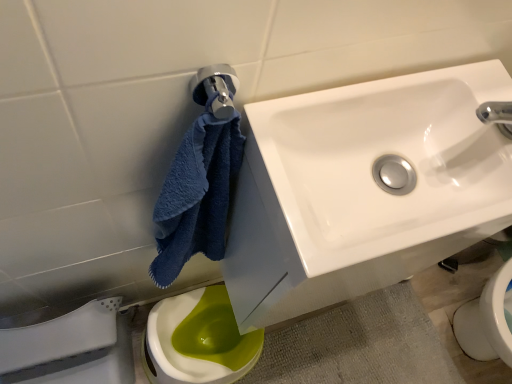
Question: Is white glossy porcelain at lower left at the right side of white glossy sink at upper right?

Choices:
 (A) no
 (B) yes

Answer: (A)

Question: Is white glossy porcelain at lower left shorter than white glossy sink at upper right?

Choices:
 (A) no
 (B) yes

Answer: (A)

Question: Considering the relative sizes of white glossy porcelain at lower left and white glossy sink at upper right in the image provided, is white glossy porcelain at lower left smaller than white glossy sink at upper right?

Choices:
 (A) no
 (B) yes

Answer: (A)

Question: Is white glossy porcelain at lower left facing away from white glossy sink at upper right?

Choices:
 (A) no
 (B) yes

Answer: (A)

Question: Is white glossy porcelain at lower left at the left side of white glossy sink at upper right?

Choices:
 (A) no
 (B) yes

Answer: (B)

Question: From the image's perspective, is white glossy porcelain at lower left below white glossy sink at upper right?

Choices:
 (A) yes
 (B) no

Answer: (A)

Question: From the image's perspective, is white glossy sink at upper right located beneath green glossy toilet at lower left?

Choices:
 (A) no
 (B) yes

Answer: (A)

Question: Can you confirm if white glossy sink at upper right is positioned to the left of green glossy toilet at lower left?

Choices:
 (A) no
 (B) yes

Answer: (A)

Question: Can you confirm if white glossy sink at upper right is positioned to the right of green glossy toilet at lower left?

Choices:
 (A) no
 (B) yes

Answer: (B)

Question: From the image's perspective, does white glossy sink at upper right appear higher than green glossy toilet at lower left?

Choices:
 (A) yes
 (B) no

Answer: (A)

Question: Is white glossy sink at upper right positioned beyond the bounds of green glossy toilet at lower left?

Choices:
 (A) yes
 (B) no

Answer: (A)

Question: Is white glossy sink at upper right aimed at green glossy toilet at lower left?

Choices:
 (A) yes
 (B) no

Answer: (B)

Question: Can you confirm if green glossy toilet at lower left is positioned to the left of white glossy sink at upper right?

Choices:
 (A) no
 (B) yes

Answer: (B)